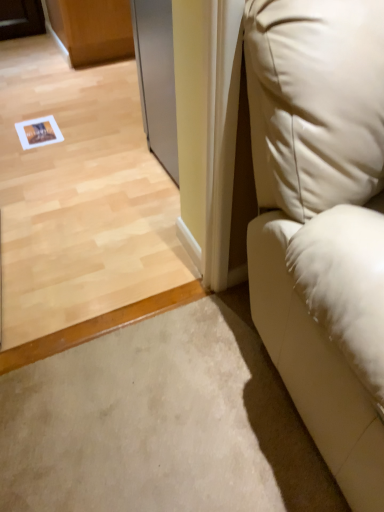
Question: Is silver metallic screen door at upper center to the left or to the right of white leather couch at right in the image?

Choices:
 (A) right
 (B) left

Answer: (B)

Question: From the image's perspective, is silver metallic screen door at upper center above or below white leather couch at right?

Choices:
 (A) below
 (B) above

Answer: (B)

Question: Based on their sizes in the image, would you say silver metallic screen door at upper center is bigger or smaller than white leather couch at right?

Choices:
 (A) small
 (B) big

Answer: (A)

Question: Based on their positions, is white leather couch at right located to the left or right of silver metallic screen door at upper center?

Choices:
 (A) right
 (B) left

Answer: (A)

Question: Is white leather couch at right bigger or smaller than silver metallic screen door at upper center?

Choices:
 (A) small
 (B) big

Answer: (B)

Question: In terms of width, does white leather couch at right look wider or thinner when compared to silver metallic screen door at upper center?

Choices:
 (A) wide
 (B) thin

Answer: (A)

Question: From their relative heights in the image, would you say white leather couch at right is taller or shorter than silver metallic screen door at upper center?

Choices:
 (A) tall
 (B) short

Answer: (A)